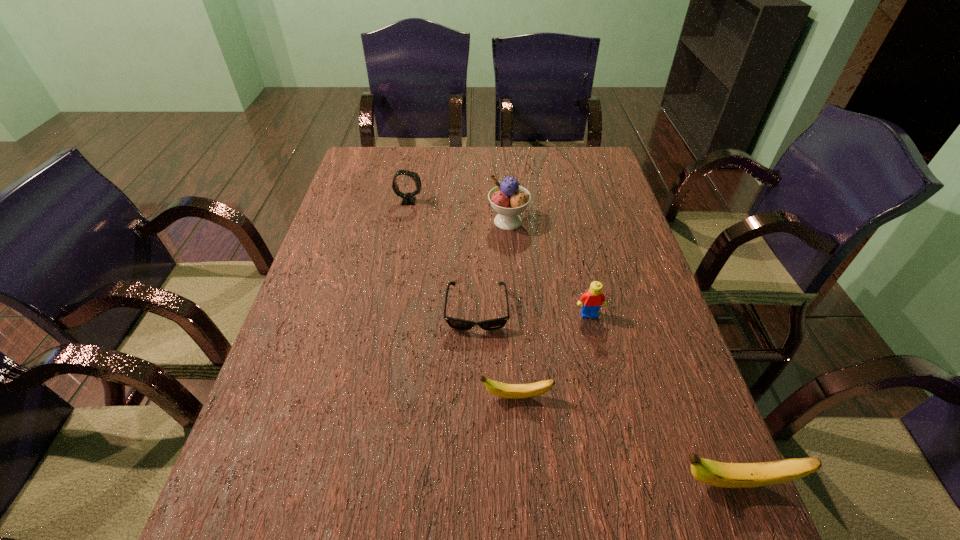
Image resolution: width=960 pixels, height=540 pixels. What are the coordinates of `the second shortest object` in the screenshot? It's located at (509, 391).

The width and height of the screenshot is (960, 540). I want to click on the fifth farthest object, so pos(509,391).

You are a GUI agent. You are given a task and a screenshot of the screen. Output one action in this format:
    pyautogui.click(x=<x>, y=<y>)
    Task: Click on the nearer banana
    The height and width of the screenshot is (540, 960).
    Given the screenshot: What is the action you would take?
    pyautogui.click(x=724, y=475)

Where is `the taller banana`? the taller banana is located at coordinates (724, 475).

At what (x,y) coordinates should I click in order to perform the action: click on the tallest object. Please return your answer as a coordinate pair (x, y). Looking at the image, I should click on (508, 199).

Where is `icecream`? icecream is located at coordinates 508,199.

Where is `the leftmost object`? The width and height of the screenshot is (960, 540). the leftmost object is located at coordinates (407, 199).

Where is `the farthest object`? Image resolution: width=960 pixels, height=540 pixels. the farthest object is located at coordinates (407, 199).

Where is `Lego`? This screenshot has width=960, height=540. Lego is located at coordinates (591, 301).

Locate an element on the screen. Image resolution: width=960 pixels, height=540 pixels. the shortest object is located at coordinates (455, 323).